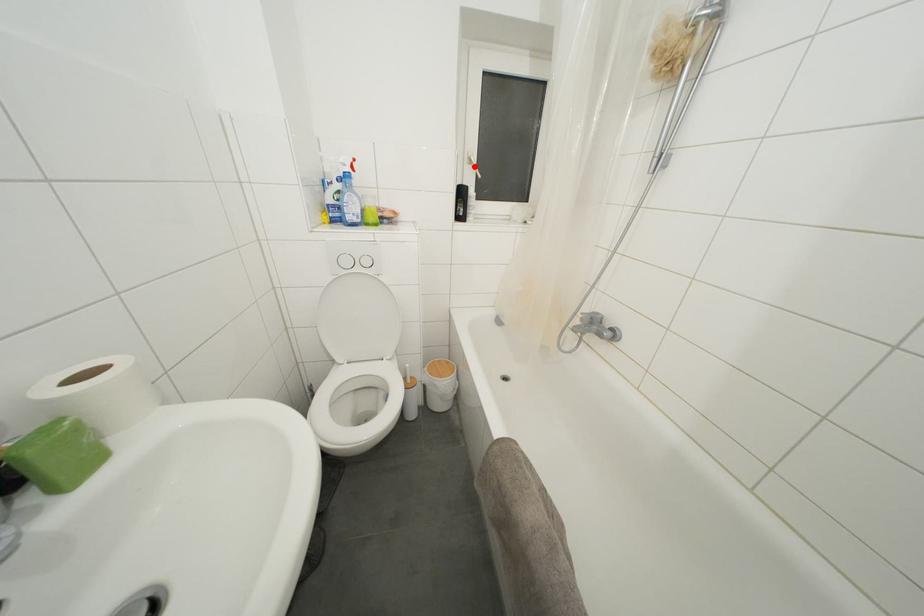
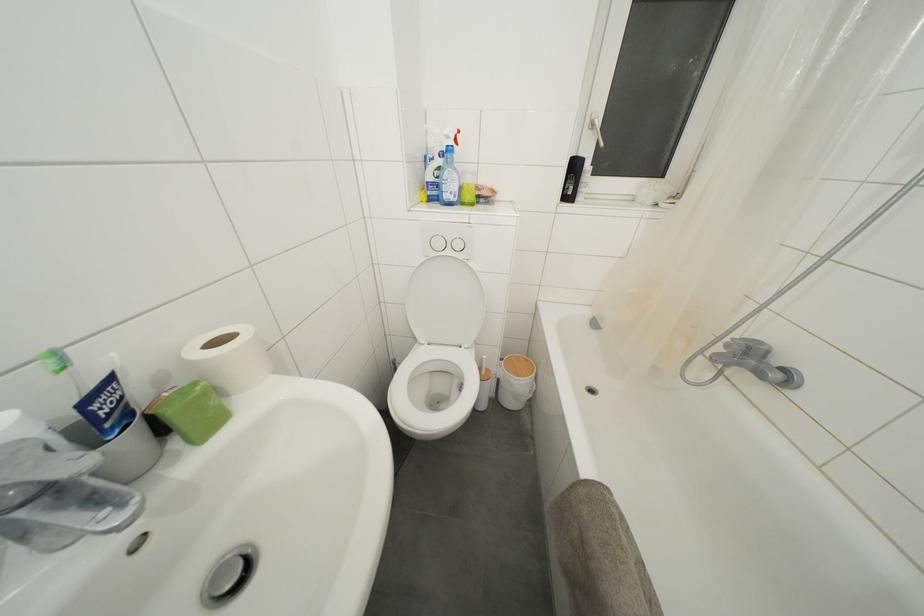
Locate, in the second image, the point that corresponds to the highlighted location in the first image.

(597, 131)